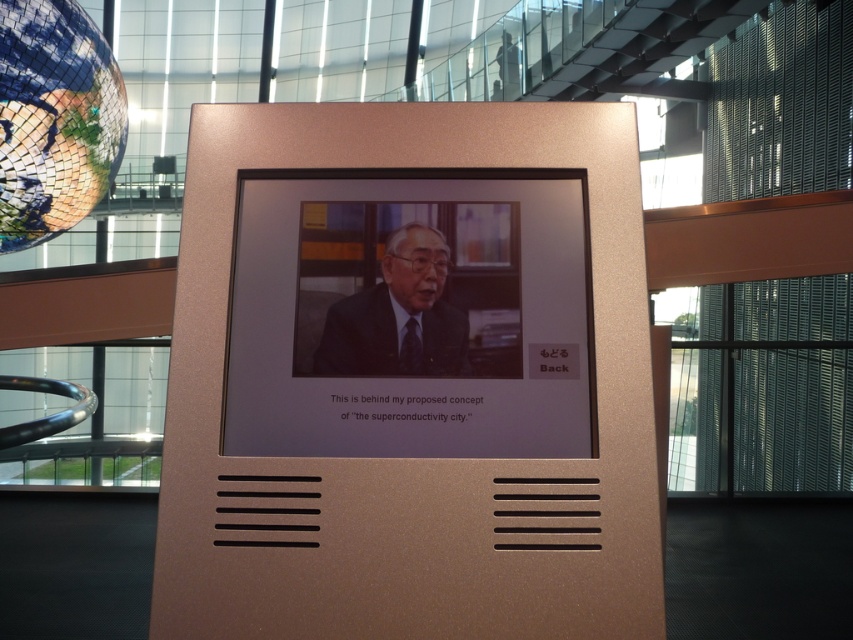
Between gold metallic plaque at center and reflective mosaic globe at upper left, which one appears on the right side from the viewer's perspective?

gold metallic plaque at center is more to the right.

I want to click on gold metallic plaque at center, so click(409, 376).

Between reflective mosaic globe at upper left and dark suit at center, which one appears on the left side from the viewer's perspective?

reflective mosaic globe at upper left

This screenshot has width=853, height=640. I want to click on reflective mosaic globe at upper left, so click(54, 118).

Measure the distance between point (73, 224) and camera.

A distance of 4.93 meters exists between point (73, 224) and camera.

Locate an element on the screen. The image size is (853, 640). reflective mosaic globe at upper left is located at coordinates pos(54,118).

Is gold metallic plaque at center thinner than satin gold frame at center?

Incorrect, gold metallic plaque at center's width is not less than satin gold frame at center's.

Between gold metallic plaque at center and satin gold frame at center, which one appears on the left side from the viewer's perspective?

From the viewer's perspective, satin gold frame at center appears more on the left side.

Does point (293, 120) come closer to viewer compared to point (503, 260)?

No, (293, 120) is further to viewer.

The image size is (853, 640). Identify the location of gold metallic plaque at center. (x=409, y=376).